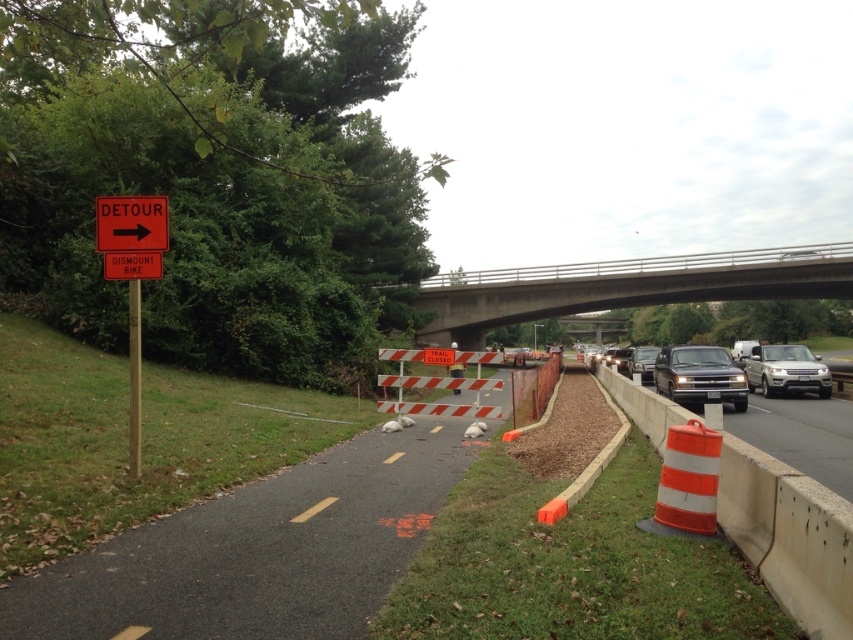
Does satin black truck at right appear on the left side of orange reflective plastic sign at upper left?

Incorrect, satin black truck at right is not on the left side of orange reflective plastic sign at upper left.

Who is more distant from viewer, [675,349] or [430,356]?

The point [675,349] is behind.

Where is `satin black truck at right`? The width and height of the screenshot is (853, 640). satin black truck at right is located at coordinates (699, 376).

Based on the photo, can you confirm if concrete bridge at upper center is shorter than red plastic detour sign at upper left?

In fact, concrete bridge at upper center may be taller than red plastic detour sign at upper left.

Is concrete bridge at upper center thinner than red plastic detour sign at upper left?

No, concrete bridge at upper center is not thinner than red plastic detour sign at upper left.

Which is behind, point (605, 276) or point (146, 225)?

The point (605, 276) is more distant.

Identify the location of concrete bridge at upper center. (624, 288).

Can you confirm if satin black truck at right is bigger than red plastic sign at upper left?

Yes, satin black truck at right is bigger than red plastic sign at upper left.

Which of these two, satin black truck at right or red plastic sign at upper left, stands shorter?

red plastic sign at upper left is shorter.

The height and width of the screenshot is (640, 853). What do you see at coordinates (699, 376) in the screenshot?
I see `satin black truck at right` at bounding box center [699, 376].

Find the location of a particular element. satin black truck at right is located at coordinates (699, 376).